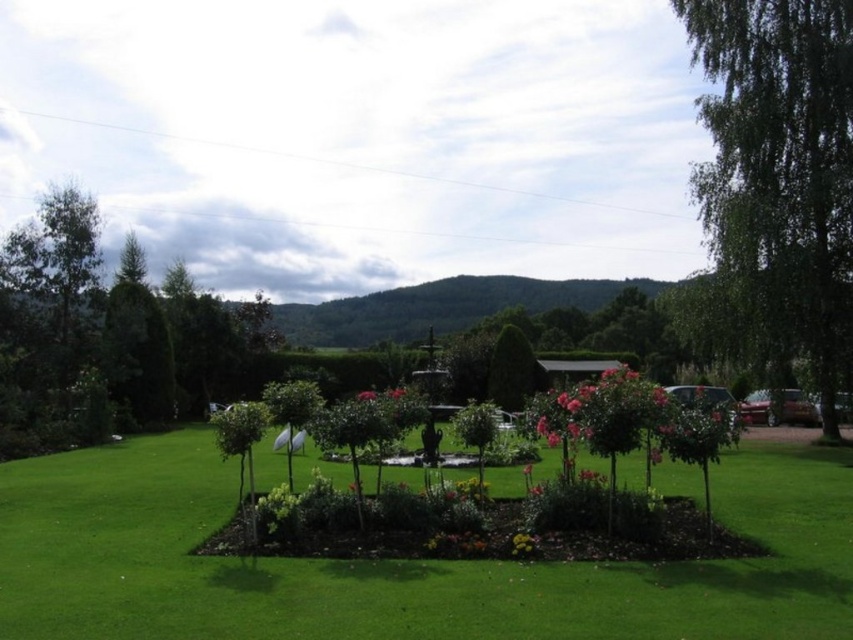
You are standing in the garden and want to take a photo of both the metallic red car at right and the glossy metallic car at right. Which car should you move closer to first to ensure both are in frame?

You should move closer to the metallic red car at right first because it is nearer to you than the glossy metallic car at right. By positioning yourself closer to the closer car, you can adjust your angle to include both in the photo without losing the farther one from view.

You are a photographer planning to capture a photo of the metallic red car at right and the glossy metallic car at right from the front. Which car should you position closer to the camera to ensure both appear equally tall in the photo?

To make both cars appear equally tall in the photo, position the metallic red car at right closer to the camera since it is taller than the glossy metallic car at right.